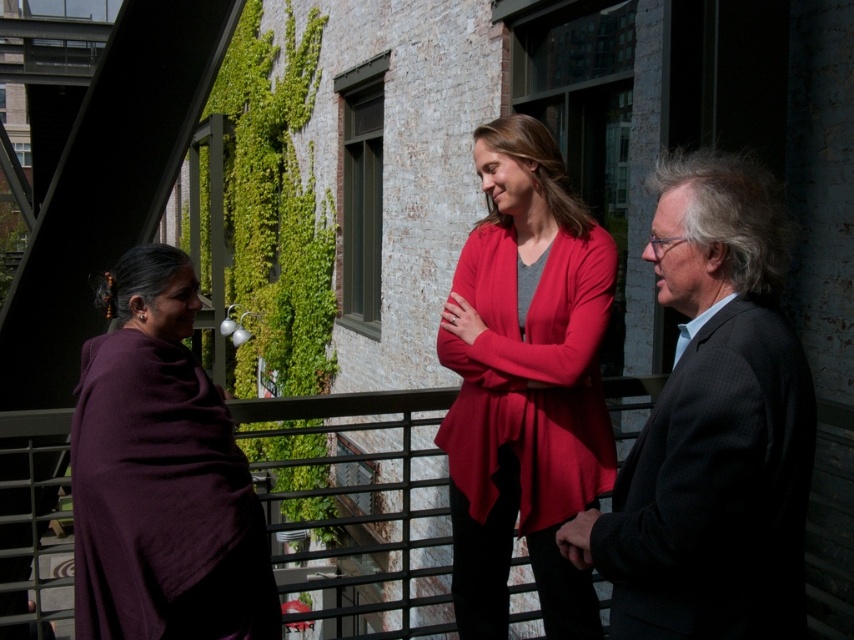
Is dark gray suit at right closer to camera compared to purple woolen shawl at left?

Yes, it is in front of purple woolen shawl at left.

Can you confirm if dark gray suit at right is positioned to the right of purple woolen shawl at left?

Correct, you'll find dark gray suit at right to the right of purple woolen shawl at left.

Between point (753, 458) and point (255, 577), which one is positioned behind?

The point (255, 577) is behind.

Find the location of a particular element. dark gray suit at right is located at coordinates (712, 428).

Is matte red cardigan at center positioned in front of purple woolen shawl at left?

No.

Between point (496, 337) and point (218, 618), which one is positioned behind?

The point (496, 337) is behind.

The width and height of the screenshot is (854, 640). What are the coordinates of `matte red cardigan at center` in the screenshot? It's located at (525, 384).

Can you confirm if dark gray suit at right is positioned below matte red cardigan at center?

Incorrect, dark gray suit at right is not positioned below matte red cardigan at center.

Between dark gray suit at right and matte red cardigan at center, which one appears on the left side from the viewer's perspective?

matte red cardigan at center

Where is `dark gray suit at right`? This screenshot has height=640, width=854. dark gray suit at right is located at coordinates (712, 428).